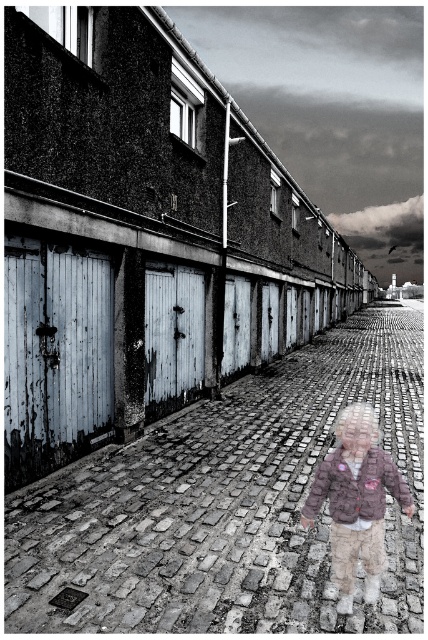
You are standing in the middle of the cobblestone street and see both the brick pavement at center and the fluffy brown jacket at center. Which object is nearer to you?

The brick pavement at center is closer to the viewer than the fluffy brown jacket at center, so the brick pavement at center is nearer to you.

You are a delivery person trying to walk through the center of the image. You have a large package that is as wide as the brick pavement at center. Can you carry it through without hitting the fluffy brown jacket at center?

The brick pavement at center is wider than the fluffy brown jacket at center, so you can carry the package through the center without hitting the jacket.

You are standing in the middle of the cobblestone street and notice a fluffy brown jacket at center and a brick pavement at center. Which object is closer to your right side?

The brick pavement at center is positioned on the right side of the fluffy brown jacket at center, so it is closer to your right side.